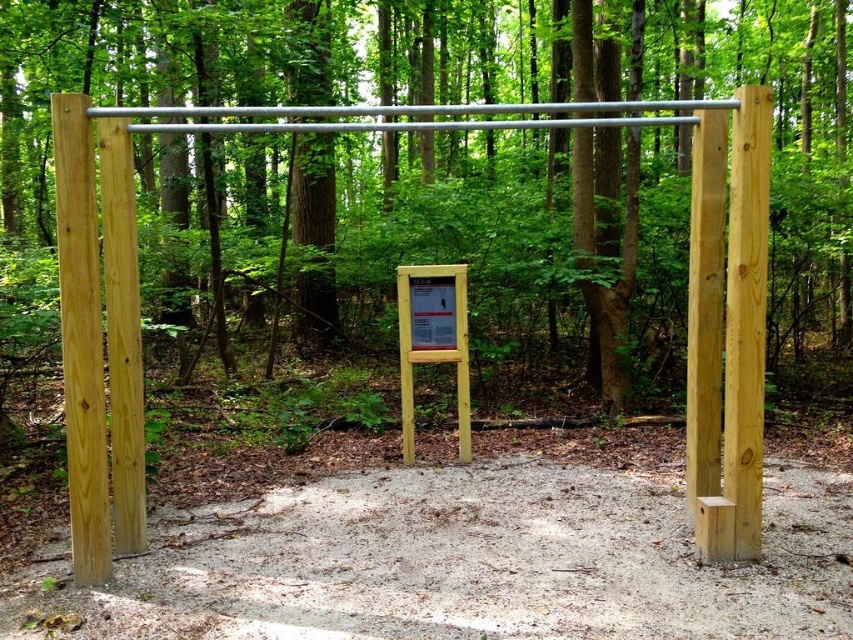
Question: Can you confirm if natural wood sign at center is positioned to the left of wooden sign at center?

Choices:
 (A) no
 (B) yes

Answer: (A)

Question: Considering the relative positions of natural wood sign at center and wooden sign at center in the image provided, where is natural wood sign at center located with respect to wooden sign at center?

Choices:
 (A) right
 (B) left

Answer: (A)

Question: Estimate the real-world distances between objects in this image. Which object is closer to the wooden sign at center?

Choices:
 (A) yellow wood sign at center
 (B) natural light wood post at left
 (C) natural wood sign at center

Answer: (A)

Question: Among these objects, which one is farthest from the camera?

Choices:
 (A) wooden sign at center
 (B) natural light wood post at left
 (C) yellow wood sign at center
 (D) natural wood sign at center

Answer: (A)

Question: Among these points, which one is nearest to the camera?

Choices:
 (A) (259, 140)
 (B) (462, 356)
 (C) (100, 396)
 (D) (438, 278)

Answer: (C)

Question: Does natural light wood post at left come in front of yellow wood sign at center?

Choices:
 (A) yes
 (B) no

Answer: (A)